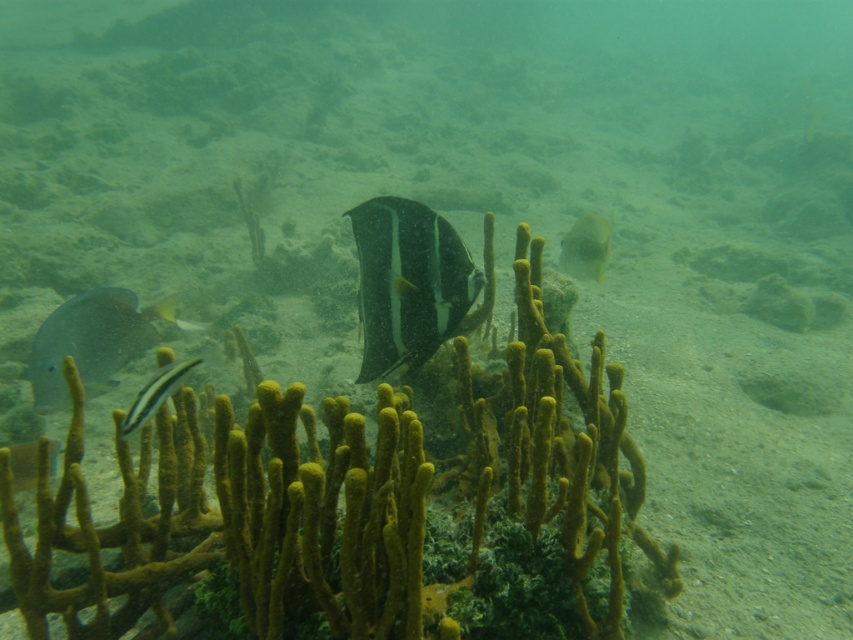
Who is positioned more to the left, shiny silver fish at lower left or shiny silver fish at center?

From the viewer's perspective, shiny silver fish at lower left appears more on the left side.

Looking at this image, does shiny silver fish at lower left come behind shiny silver fish at center?

Yes, shiny silver fish at lower left is behind shiny silver fish at center.

Locate an element on the screen. Image resolution: width=853 pixels, height=640 pixels. shiny silver fish at lower left is located at coordinates (91, 340).

Is the position of black glossy fish at center more distant than that of yellow matte fish at center?

No, it is in front of yellow matte fish at center.

Between black glossy fish at center and yellow matte fish at center, which one is positioned lower?

Positioned lower is black glossy fish at center.

Who is more forward, (361, 296) or (567, 256)?

Positioned in front is point (361, 296).

I want to click on black glossy fish at center, so click(407, 282).

Does point (529, 244) lie behind point (596, 278)?

No, it is not.

Is point (296, 540) closer to camera compared to point (579, 236)?

That is True.

Is point (596, 616) farther from camera compared to point (569, 273)?

No, (596, 616) is in front of (569, 273).

The image size is (853, 640). I want to click on yellow soft coral at center, so click(x=258, y=516).